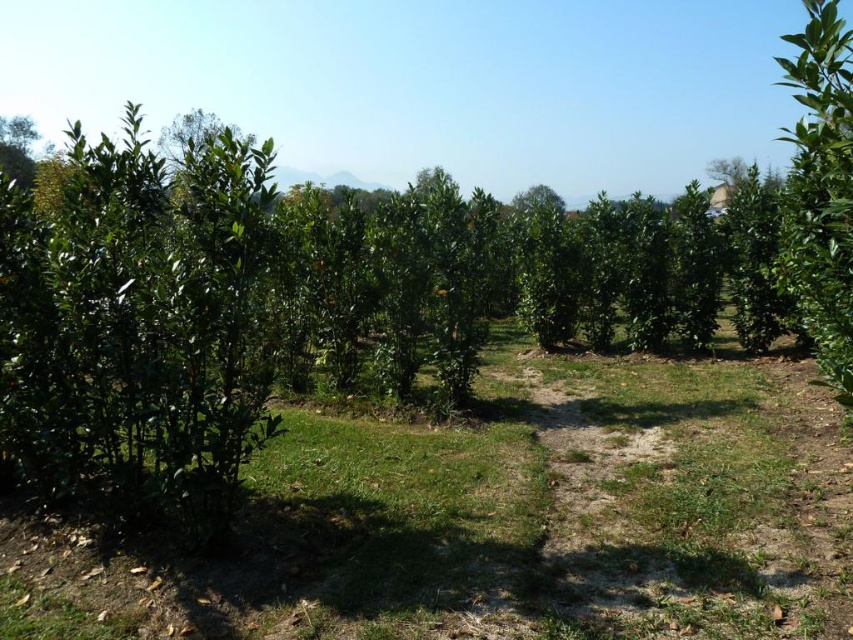
Who is lower down, green grass at center or green leafy tree at upper right?

green grass at center

Is green grass at center bigger than green leafy tree at upper right?

No.

Identify the location of green grass at center. The image size is (853, 640). (498, 518).